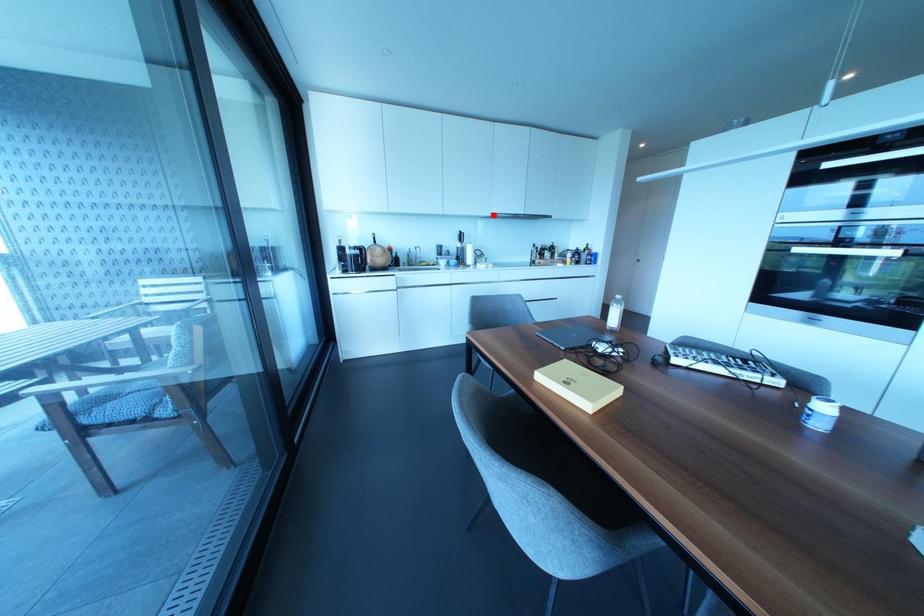
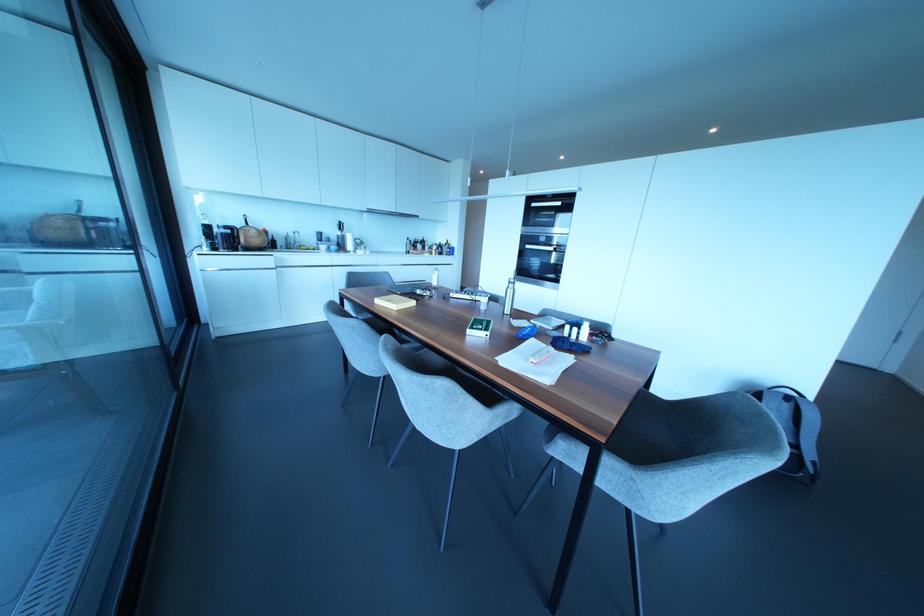
In the second image, find the point that corresponds to the highlighted location in the first image.

(370, 209)